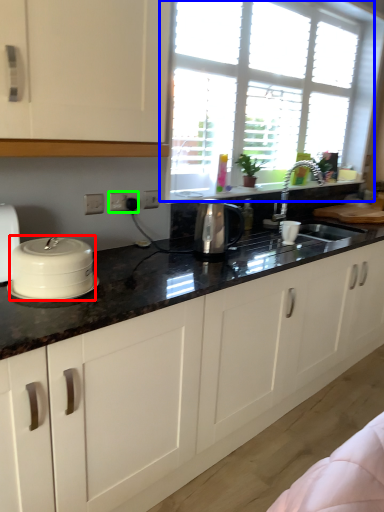
Question: Estimate the real-world distances between objects in this image. Which object is farther from home appliance (highlighted by a red box), window (highlighted by a blue box) or electric outlet (highlighted by a green box)?

Choices:
 (A) window
 (B) electric outlet

Answer: (A)